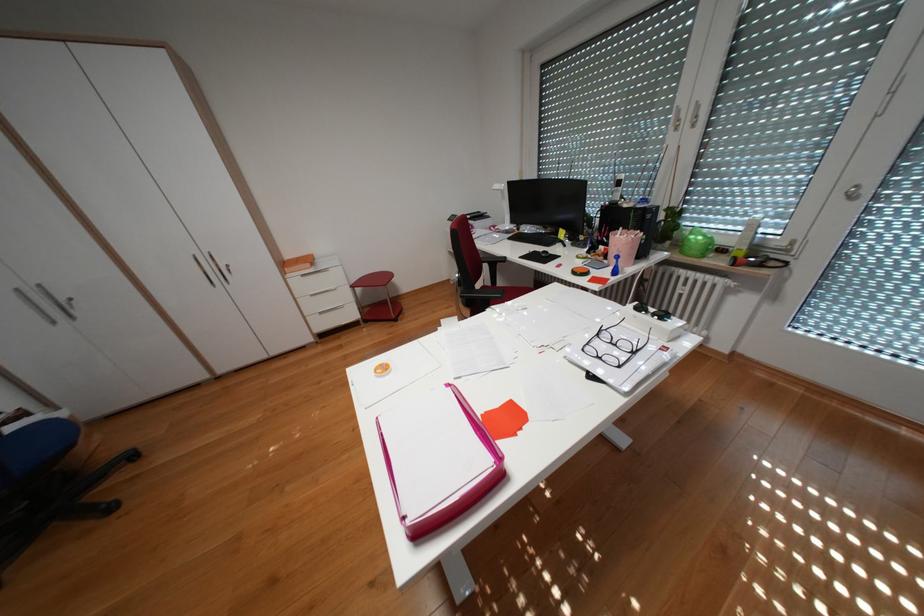
Describe the element at coordinates (484, 294) in the screenshot. The height and width of the screenshot is (616, 924). I see `a black chair armrest` at that location.